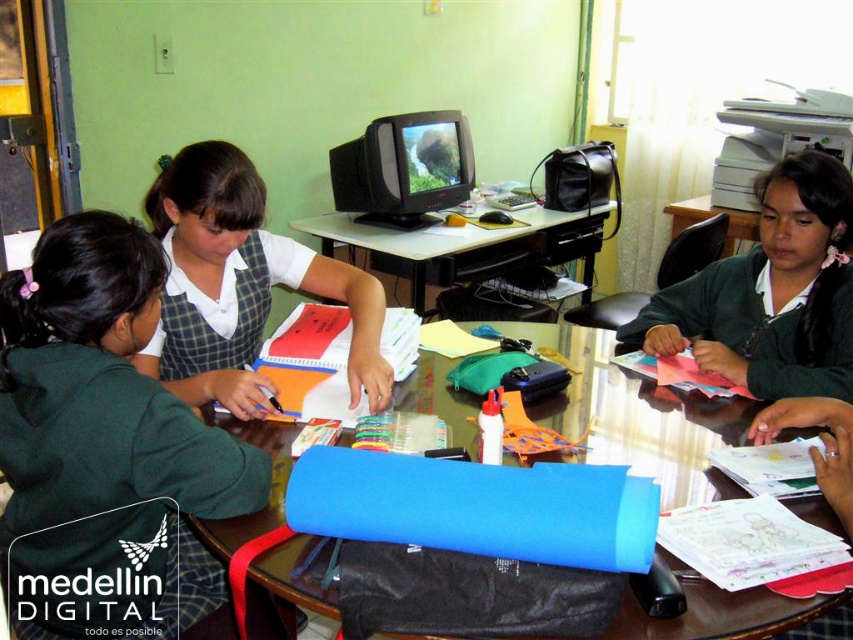
Question: Can you confirm if white glossy table at center is positioned to the right of black plastic crt monitor at center?

Choices:
 (A) yes
 (B) no

Answer: (A)

Question: Which object appears farthest from the camera in this image?

Choices:
 (A) black plastic crt monitor at center
 (B) white glossy table at center
 (C) green matte uniform at center

Answer: (A)

Question: Is green matte uniform at center positioned at the back of transparent plastic table at center?

Choices:
 (A) yes
 (B) no

Answer: (B)

Question: Among these points, which one is nearest to the camera?

Choices:
 (A) (399, 140)
 (B) (759, 243)
 (C) (730, 216)
 (D) (422, 284)

Answer: (B)

Question: Where is blue fabric at center located in relation to transparent plastic table at center in the image?

Choices:
 (A) below
 (B) above

Answer: (A)

Question: Based on their relative distances, which object is farther from the green fabric at left?

Choices:
 (A) white glossy table at center
 (B) green matte uniform at center
 (C) black plastic crt monitor at center

Answer: (C)